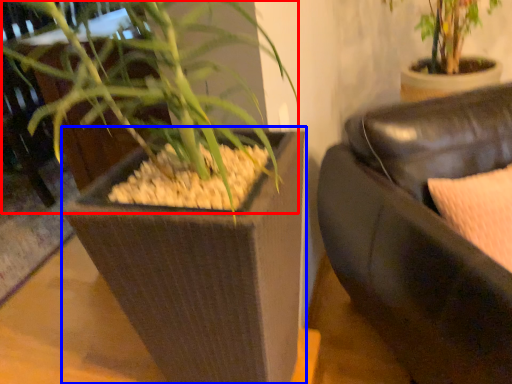
Question: Which point is further to the camera, orchid (highlighted by a red box) or flowerpot (highlighted by a blue box)?

Choices:
 (A) orchid
 (B) flowerpot

Answer: (B)